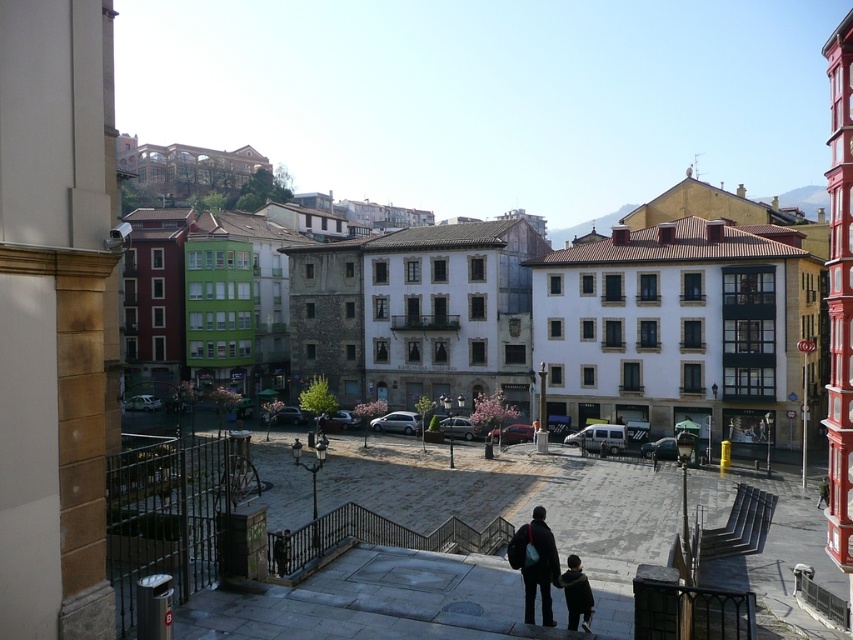
Question: Based on their relative distances, which object is nearer to the gray concrete pavement at center?

Choices:
 (A) white stone building at center
 (B) dark blue jacket at lower center
 (C) dark blue backpack at lower center

Answer: (C)

Question: Does white stone building at center appear on the right side of dark blue backpack at lower center?

Choices:
 (A) yes
 (B) no

Answer: (A)

Question: Which point is farther from the camera taking this photo?

Choices:
 (A) (x=573, y=563)
 (B) (x=605, y=602)

Answer: (B)

Question: Can you confirm if gray concrete pavement at center is positioned above dark blue backpack at lower center?

Choices:
 (A) yes
 (B) no

Answer: (B)

Question: Observing the image, what is the correct spatial positioning of white stone building at center in reference to gray concrete pavement at center?

Choices:
 (A) below
 (B) above

Answer: (B)

Question: Which point is closer to the camera taking this photo?

Choices:
 (A) 544,612
 (B) 643,524

Answer: (A)